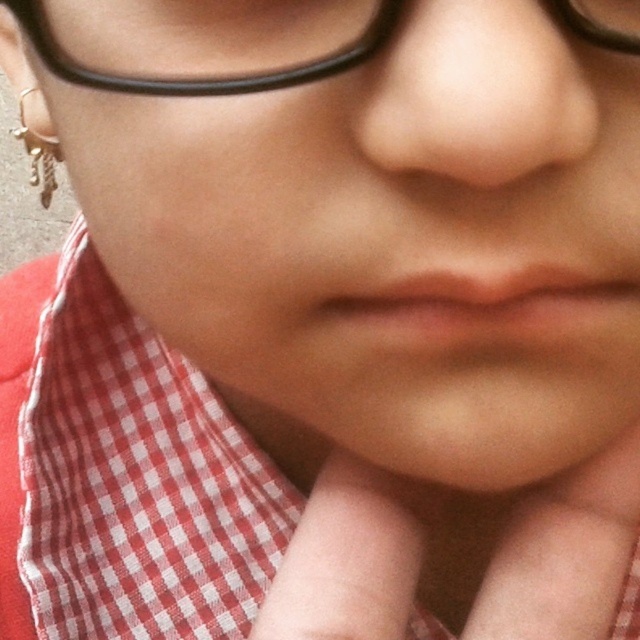
Question: Is red checkered fabric at center bigger than gold metallic chain at lower left?

Choices:
 (A) yes
 (B) no

Answer: (A)

Question: Is black plastic glasses at upper center below gold metallic chain at lower left?

Choices:
 (A) no
 (B) yes

Answer: (B)

Question: Which object is positioned closest to the red checkered fabric at center?

Choices:
 (A) gold metallic chain at lower left
 (B) black plastic glasses at upper center

Answer: (A)

Question: Which point is farther to the camera?

Choices:
 (A) (36, 141)
 (B) (26, 353)

Answer: (B)

Question: Can you confirm if red checkered fabric at center is wider than black plastic glasses at upper center?

Choices:
 (A) no
 (B) yes

Answer: (B)

Question: Based on their relative distances, which object is farther from the black plastic glasses at upper center?

Choices:
 (A) red checkered fabric at center
 (B) gold metallic chain at lower left

Answer: (A)